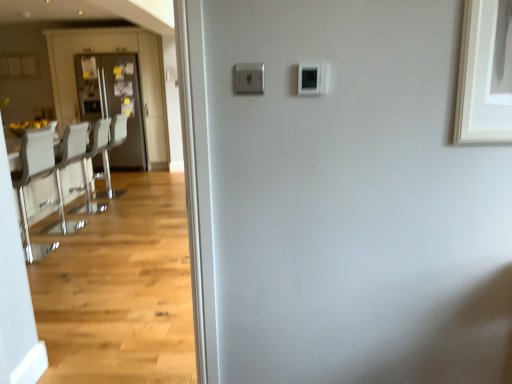
I want to click on free spot to the right of white leather chairs at left, so click(117, 225).